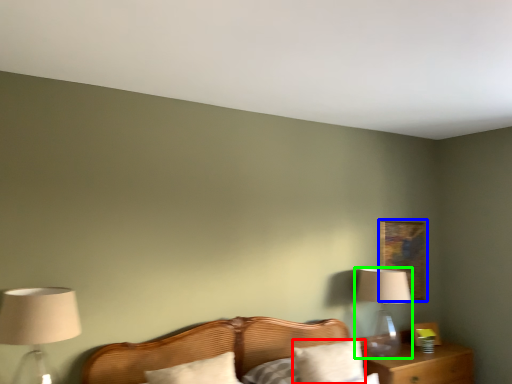
Question: Based on their relative distances, which object is farther from pillow (highlighted by a red box)? Choose from picture frame (highlighted by a blue box) and table lamp (highlighted by a green box).

Choices:
 (A) picture frame
 (B) table lamp

Answer: (A)